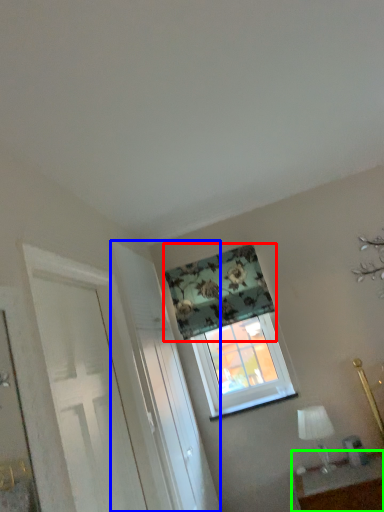
Question: Considering the real-world distances, which object is closest to curtain (highlighted by a red box)? screen door (highlighted by a blue box) or table (highlighted by a green box).

Choices:
 (A) screen door
 (B) table

Answer: (A)